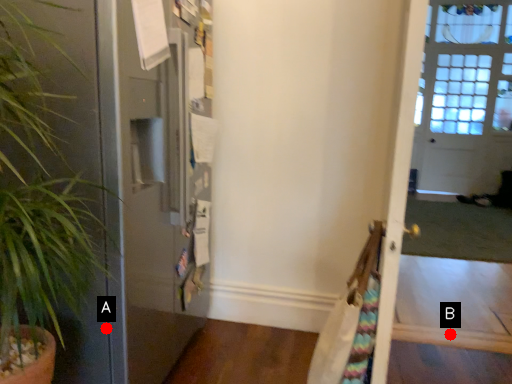
Question: Two points are circled on the image, labeled by A and B beside each circle. Which point is closer to the camera?

Choices:
 (A) A is closer
 (B) B is closer

Answer: (A)